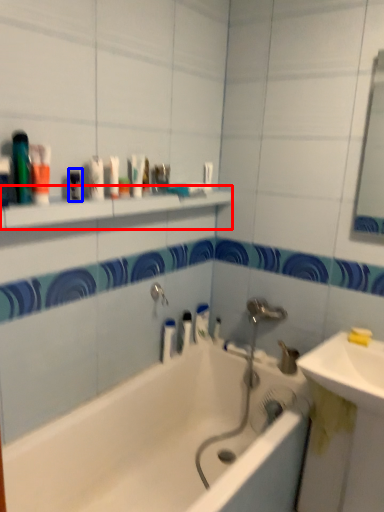
Question: Which of the following is the farthest to the observer, shelve (highlighted by a red box) or mouthwash (highlighted by a blue box)?

Choices:
 (A) shelve
 (B) mouthwash

Answer: (B)